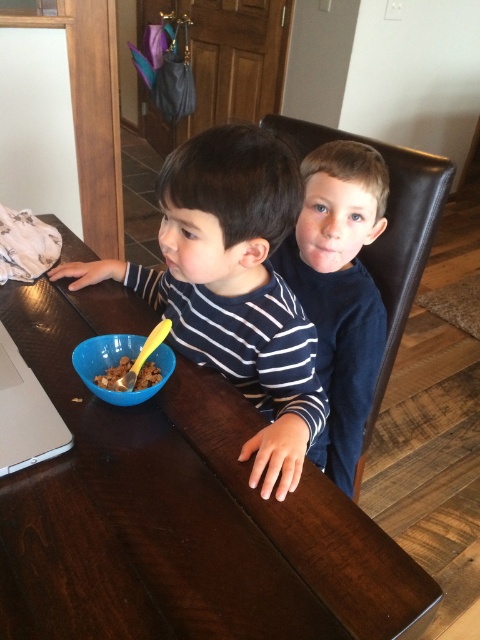
Question: Does silver metallic laptop at left have a larger size compared to blue plastic bowl at center?

Choices:
 (A) yes
 (B) no

Answer: (A)

Question: Estimate the real-world distances between objects in this image. Which object is farther from the striped cotton shirt at center?

Choices:
 (A) dark blue shirt at center
 (B) brown crumbly cereal at lower left

Answer: (A)

Question: In this image, where is silver metallic laptop at left located relative to brown crumbly cereal at lower left?

Choices:
 (A) below
 (B) above

Answer: (A)

Question: Is striped cotton shirt at center thinner than brown crumbly cereal at lower left?

Choices:
 (A) no
 (B) yes

Answer: (A)

Question: Which point is farther to the camera?

Choices:
 (A) blue plastic bowl at center
 (B) dark blue shirt at center
 (C) striped cotton shirt at center
 (D) brown crumbly cereal at lower left

Answer: (B)

Question: Which point is closer to the camera?

Choices:
 (A) silver metallic laptop at left
 (B) dark blue shirt at center

Answer: (A)